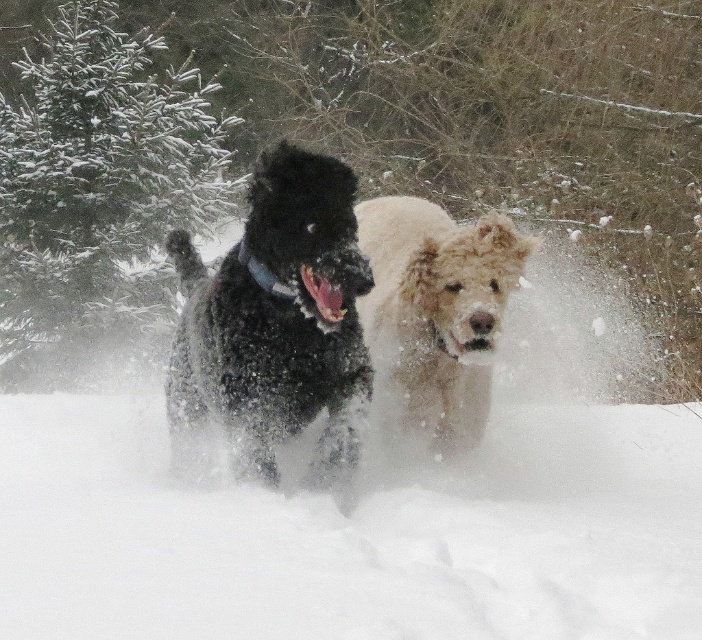
Who is shorter, white fluffy snow at center or green textured pine at upper left?

white fluffy snow at center is shorter.

Does white fluffy snow at center have a smaller size compared to green textured pine at upper left?

Indeed, white fluffy snow at center has a smaller size compared to green textured pine at upper left.

Who is more forward, (322, 576) or (159, 140)?

Positioned in front is point (322, 576).

The height and width of the screenshot is (640, 702). I want to click on white fluffy snow at center, so click(351, 532).

Can you confirm if black fluffy dog at center is positioned to the left of fuzzy beige dog at center?

Correct, you'll find black fluffy dog at center to the left of fuzzy beige dog at center.

Measure the distance between black fluffy dog at center and camera.

A distance of 5.16 meters exists between black fluffy dog at center and camera.

At what (x,y) coordinates should I click in order to perform the action: click on black fluffy dog at center. Please return your answer as a coordinate pair (x, y). Looking at the image, I should click on pyautogui.click(x=277, y=314).

Between point (590, 404) and point (234, 246), which one is positioned in front?

Point (234, 246) is more forward.

Who is more distant from viewer, (600, 429) or (185, 280)?

Positioned behind is point (600, 429).

The image size is (702, 640). I want to click on white fluffy snow at center, so click(x=351, y=532).